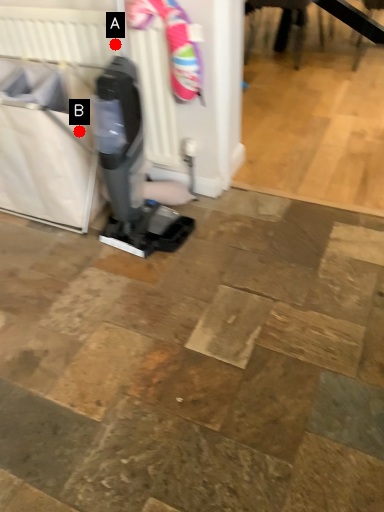
Question: Two points are circled on the image, labeled by A and B beside each circle. Among these points, which one is farthest from the camera?

Choices:
 (A) A is further
 (B) B is further

Answer: (B)